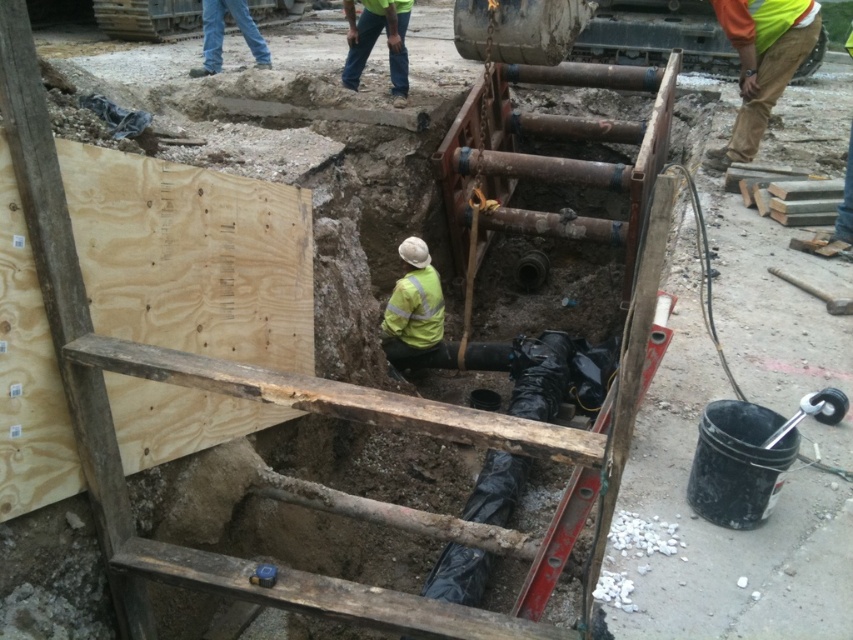
In the scene shown: You are a safety inspector at the construction site. You notice two items in the scene that need inspection for compliance with safety standards. The items are the green reflective jacket at center and the blue jeans at upper left. Which of these items is smaller in size?

The green reflective jacket at center is smaller than the blue jeans at upper left.